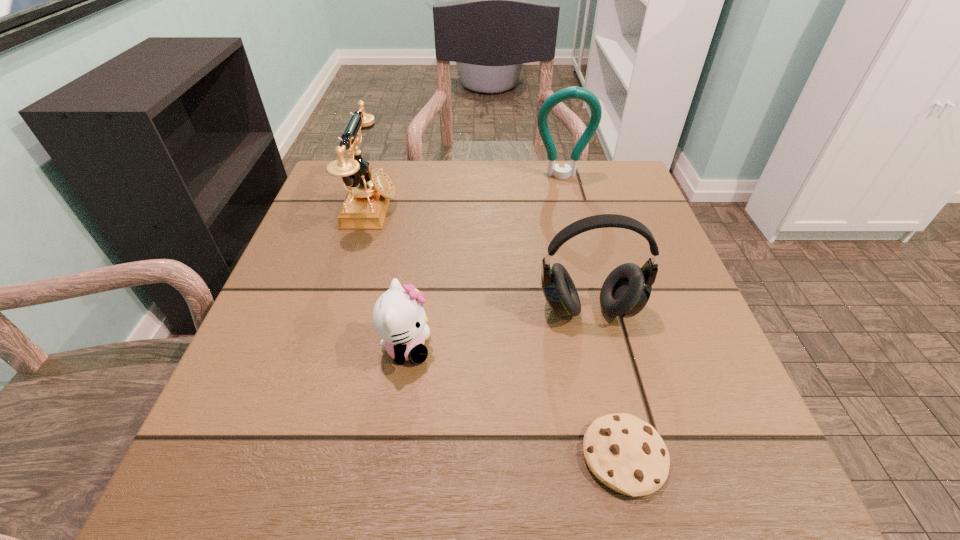
Where is `vacant space in between the bottle opener and the fourth tallest object`? Image resolution: width=960 pixels, height=540 pixels. vacant space in between the bottle opener and the fourth tallest object is located at coordinates [484, 262].

This screenshot has width=960, height=540. In order to click on empty space that is in between the kitten and the bottle opener in this screenshot , I will do `click(484, 262)`.

You are a GUI agent. You are given a task and a screenshot of the screen. Output one action in this format:
    pyautogui.click(x=<x>, y=<y>)
    Task: Click on the unoccupied area between the bottle opener and the kitten
    
    Given the screenshot: What is the action you would take?
    pyautogui.click(x=484, y=262)

I want to click on empty location between the bottle opener and the cookie, so click(593, 316).

Locate an element on the screen. free point between the telephone and the cookie is located at coordinates (x=498, y=332).

The width and height of the screenshot is (960, 540). What are the coordinates of `empty space between the shortest object and the bottle opener` in the screenshot? It's located at (593, 316).

In order to click on free space that is in between the cookie and the bottle opener in this screenshot , I will do `click(593, 316)`.

At what (x,y) coordinates should I click in order to perform the action: click on object identified as the closest to the headset. Please return your answer as a coordinate pair (x, y). The height and width of the screenshot is (540, 960). Looking at the image, I should click on (625, 453).

Image resolution: width=960 pixels, height=540 pixels. I want to click on object that is the fourth closest one to the headset, so click(x=575, y=92).

At what (x,y) coordinates should I click in order to perform the action: click on free space that satisfies the following two spatial constraints: 1. on the front-facing side of the cookie; 2. on the left side of the second shortest object. Please return your answer as a coordinate pair (x, y). Looking at the image, I should click on (391, 456).